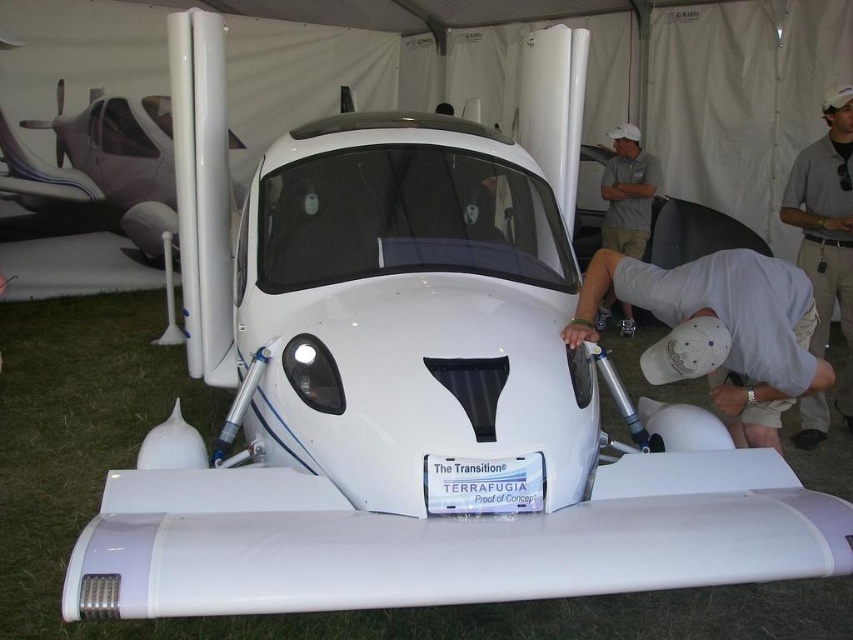
Who is shorter, white glossy airplane at upper left or white cotton shirt at upper center?

With less height is white cotton shirt at upper center.

Does white glossy airplane at upper left have a greater height compared to white cotton shirt at upper center?

Indeed, white glossy airplane at upper left has a greater height compared to white cotton shirt at upper center.

Is point (173, 186) farther from camera compared to point (656, 168)?

Yes, it is.

Identify the location of white glossy airplane at upper left. (105, 163).

Can you confirm if white matte helmet at lower center is shorter than white cotton shirt at upper center?

Indeed, white matte helmet at lower center has a lesser height compared to white cotton shirt at upper center.

Does white matte helmet at lower center have a smaller size compared to white cotton shirt at upper center?

No, white matte helmet at lower center is not smaller than white cotton shirt at upper center.

Who is more forward, (x=810, y=312) or (x=631, y=236)?

Positioned in front is point (x=810, y=312).

Where is `white matte helmet at lower center`? white matte helmet at lower center is located at coordinates tap(718, 330).

Between white matte helmet at lower center and white glossy airplane at upper left, which one has less height?

white matte helmet at lower center is shorter.

Which is behind, point (662, 278) or point (123, 196)?

Point (123, 196)

Is point (793, 284) closer to viewer compared to point (177, 243)?

Yes, it is in front of point (177, 243).

Where is `white matte helmet at lower center`? The image size is (853, 640). white matte helmet at lower center is located at coordinates (718, 330).